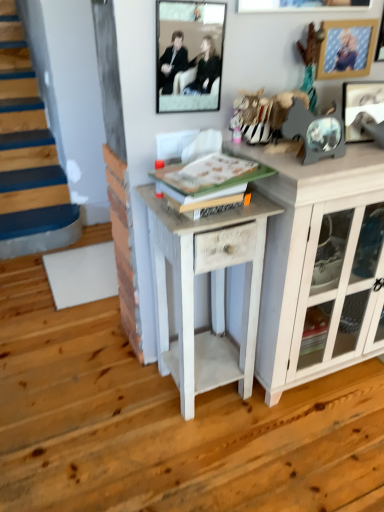
Describe the element at coordinates (193, 292) in the screenshot. Image resolution: width=384 pixels, height=512 pixels. I see `white painted wood side table at center` at that location.

Locate an element on the screen. Image resolution: width=384 pixels, height=512 pixels. matte black frame at upper center, which ranks as the 3th picture frame in right-to-left order is located at coordinates (189, 55).

In order to face wooden picture frame at upper right, acting as the second picture frame starting from the left, should I rotate leftwards or rightwards?

Turn right approximately 19.750 degrees to face it.

What do you see at coordinates (346, 48) in the screenshot? This screenshot has width=384, height=512. I see `wooden picture frame at upper right, the second picture frame when ordered from right to left` at bounding box center [346, 48].

What is the approximate height of white wood cabinet at right?

white wood cabinet at right is 35.92 inches tall.

Image resolution: width=384 pixels, height=512 pixels. What are the coordinates of `white painted wood side table at center` in the screenshot? It's located at (193, 292).

Is the depth of metallic silver picture frame at upper right, positioned as the 1th picture frame in right-to-left order, less than that of wooden picture frame at upper right, acting as the second picture frame starting from the left?

That is True.

From a real-world perspective, who is located higher, metallic silver picture frame at upper right, positioned as the 1th picture frame in right-to-left order, or wooden picture frame at upper right, acting as the second picture frame starting from the left?

wooden picture frame at upper right, acting as the second picture frame starting from the left.

Based on their sizes in the image, would you say metallic silver picture frame at upper right, positioned as the 1th picture frame in right-to-left order, is bigger or smaller than wooden picture frame at upper right, the second picture frame when ordered from right to left?

Considering their sizes, metallic silver picture frame at upper right, positioned as the 1th picture frame in right-to-left order, takes up more space than wooden picture frame at upper right, the second picture frame when ordered from right to left.

Is metallic silver picture frame at upper right, positioned as the 1th picture frame in right-to-left order, oriented towards wooden picture frame at upper right, the second picture frame when ordered from right to left?

No.

From the image's perspective, which is below, wooden picture frame at upper right, acting as the second picture frame starting from the left, or matte black frame at upper center, positioned as the 1th picture frame in left-to-right order?

matte black frame at upper center, positioned as the 1th picture frame in left-to-right order.

Can you confirm if wooden picture frame at upper right, acting as the second picture frame starting from the left, is thinner than matte black frame at upper center, which ranks as the 3th picture frame in right-to-left order?

In fact, wooden picture frame at upper right, acting as the second picture frame starting from the left, might be wider than matte black frame at upper center, which ranks as the 3th picture frame in right-to-left order.

Is wooden picture frame at upper right, the second picture frame when ordered from right to left, turned away from matte black frame at upper center, positioned as the 1th picture frame in left-to-right order?

wooden picture frame at upper right, the second picture frame when ordered from right to left, does not have its back to matte black frame at upper center, positioned as the 1th picture frame in left-to-right order.

From a real-world perspective, is wooden picture frame at upper right, the second picture frame when ordered from right to left, beneath matte black frame at upper center, positioned as the 1th picture frame in left-to-right order?

No, from a real-world perspective, wooden picture frame at upper right, the second picture frame when ordered from right to left, is not beneath matte black frame at upper center, positioned as the 1th picture frame in left-to-right order.

From the image's perspective, does metallic silver picture frame at upper right, positioned as the 1th picture frame in right-to-left order, appear lower than white wood cabinet at right?

No, from the image's perspective, metallic silver picture frame at upper right, positioned as the 1th picture frame in right-to-left order, is not below white wood cabinet at right.

Which of these two, metallic silver picture frame at upper right, the 3th picture frame when ordered from left to right, or white wood cabinet at right, stands shorter?

With less height is metallic silver picture frame at upper right, the 3th picture frame when ordered from left to right.

Are metallic silver picture frame at upper right, the 3th picture frame when ordered from left to right, and white wood cabinet at right beside each other?

They are not placed beside each other.

Considering the points (349, 97) and (357, 236), which point is behind, point (349, 97) or point (357, 236)?

Point (357, 236)

Is point (336, 61) positioned in front of point (268, 231)?

No, it is not.

From the image's perspective, who appears lower, wooden picture frame at upper right, the second picture frame when ordered from right to left, or white wood cabinet at right?

From the image's view, white wood cabinet at right is below.

There is a white wood cabinet at right. Find the location of `the 3rd picture frame above it (from a real-world perspective)`. the 3rd picture frame above it (from a real-world perspective) is located at coordinates (346, 48).

Considering the relative sizes of wooden picture frame at upper right, acting as the second picture frame starting from the left, and white wood cabinet at right in the image provided, is wooden picture frame at upper right, acting as the second picture frame starting from the left, thinner than white wood cabinet at right?

Indeed, wooden picture frame at upper right, acting as the second picture frame starting from the left, has a lesser width compared to white wood cabinet at right.

I want to click on picture frame that appears below the matte black frame at upper center, positioned as the 1th picture frame in left-to-right order (from a real-world perspective), so click(361, 106).

Considering the sizes of objects matte black frame at upper center, which ranks as the 3th picture frame in right-to-left order, and metallic silver picture frame at upper right, the 3th picture frame when ordered from left to right, in the image provided, who is thinner, matte black frame at upper center, which ranks as the 3th picture frame in right-to-left order, or metallic silver picture frame at upper right, the 3th picture frame when ordered from left to right,?

With smaller width is matte black frame at upper center, which ranks as the 3th picture frame in right-to-left order.

From a real-world perspective, which object rests below the other?

From a 3D spatial view, metallic silver picture frame at upper right, positioned as the 1th picture frame in right-to-left order, is below.

Is matte black frame at upper center, which ranks as the 3th picture frame in right-to-left order, further to the viewer compared to metallic silver picture frame at upper right, the 3th picture frame when ordered from left to right?

No.

From the picture: Which is behind, white painted wood side table at center or white wood cabinet at right?

white wood cabinet at right is behind.

From a real-world perspective, is white painted wood side table at center below white wood cabinet at right?

Yes, from a real-world perspective, white painted wood side table at center is beneath white wood cabinet at right.

From the image's perspective, who appears lower, white painted wood side table at center or white wood cabinet at right?

white painted wood side table at center, from the image's perspective.

Does white painted wood side table at center have a smaller size compared to white wood cabinet at right?

Yes, white painted wood side table at center is smaller than white wood cabinet at right.

Can you confirm if white wood cabinet at right is positioned to the right of matte black frame at upper center, positioned as the 1th picture frame in left-to-right order?

Yes, white wood cabinet at right is to the right of matte black frame at upper center, positioned as the 1th picture frame in left-to-right order.

Consider the image. Can you tell me how much white wood cabinet at right and matte black frame at upper center, which ranks as the 3th picture frame in right-to-left order, differ in facing direction?

0.308 degrees.

Locate an element on the screen. The image size is (384, 512). cabinetry below the matte black frame at upper center, which ranks as the 3th picture frame in right-to-left order (from the image's perspective) is located at coordinates (320, 266).

From a real-world perspective, which is physically above, white wood cabinet at right or matte black frame at upper center, which ranks as the 3th picture frame in right-to-left order?

matte black frame at upper center, which ranks as the 3th picture frame in right-to-left order, from a real-world perspective.

Identify the location of the 2nd picture frame located above the metallic silver picture frame at upper right, positioned as the 1th picture frame in right-to-left order (from a real-world perspective). (346, 48).

From a real-world perspective, starting from the wooden picture frame at upper right, the second picture frame when ordered from right to left, which picture frame is the 1st one below it? Please provide its 2D coordinates.

[(189, 55)]

Estimate the real-world distances between objects in this image. Which object is closer to white wood cabinet at right, matte black frame at upper center, positioned as the 1th picture frame in left-to-right order, or white painted wood side table at center?

Based on the image, white painted wood side table at center appears to be nearer to white wood cabinet at right.

Estimate the real-world distances between objects in this image. Which object is further from matte black frame at upper center, positioned as the 1th picture frame in left-to-right order, white painted wood side table at center or metallic silver picture frame at upper right, positioned as the 1th picture frame in right-to-left order?

white painted wood side table at center lies further to matte black frame at upper center, positioned as the 1th picture frame in left-to-right order, than the other object.

Based on their spatial positions, is wooden picture frame at upper right, acting as the second picture frame starting from the left, or white wood cabinet at right closer to matte black frame at upper center, positioned as the 1th picture frame in left-to-right order?

wooden picture frame at upper right, acting as the second picture frame starting from the left, is closer to matte black frame at upper center, positioned as the 1th picture frame in left-to-right order.

Considering their positions, is matte black frame at upper center, which ranks as the 3th picture frame in right-to-left order, positioned further to white painted wood side table at center than wooden picture frame at upper right, the second picture frame when ordered from right to left?

The object further to white painted wood side table at center is wooden picture frame at upper right, the second picture frame when ordered from right to left.

Looking at the image, which one is located closer to white wood cabinet at right, white painted wood side table at center or matte black frame at upper center, which ranks as the 3th picture frame in right-to-left order?

white painted wood side table at center is closer to white wood cabinet at right.

From the image, which object appears to be nearer to white painted wood side table at center, wooden picture frame at upper right, acting as the second picture frame starting from the left, or matte black frame at upper center, positioned as the 1th picture frame in left-to-right order?

matte black frame at upper center, positioned as the 1th picture frame in left-to-right order, is closer to white painted wood side table at center.

From the image, which object appears to be nearer to metallic silver picture frame at upper right, the 3th picture frame when ordered from left to right, white wood cabinet at right or wooden picture frame at upper right, acting as the second picture frame starting from the left?

Based on the image, wooden picture frame at upper right, acting as the second picture frame starting from the left, appears to be nearer to metallic silver picture frame at upper right, the 3th picture frame when ordered from left to right.

In the scene shown: When comparing their distances from matte black frame at upper center, which ranks as the 3th picture frame in right-to-left order, does metallic silver picture frame at upper right, positioned as the 1th picture frame in right-to-left order, or white wood cabinet at right seem closer?

The object closer to matte black frame at upper center, which ranks as the 3th picture frame in right-to-left order, is metallic silver picture frame at upper right, positioned as the 1th picture frame in right-to-left order.

I want to click on cabinetry between matte black frame at upper center, which ranks as the 3th picture frame in right-to-left order, and metallic silver picture frame at upper right, positioned as the 1th picture frame in right-to-left order, in the horizontal direction, so click(320, 266).

You are a GUI agent. You are given a task and a screenshot of the screen. Output one action in this format:
    pyautogui.click(x=<x>, y=<y>)
    Task: Click on the picture frame situated between matte black frame at upper center, positioned as the 1th picture frame in left-to-right order, and metallic silver picture frame at upper right, positioned as the 1th picture frame in right-to-left order, from left to right
    The height and width of the screenshot is (512, 384).
    Given the screenshot: What is the action you would take?
    pyautogui.click(x=346, y=48)

The width and height of the screenshot is (384, 512). I want to click on picture frame between matte black frame at upper center, positioned as the 1th picture frame in left-to-right order, and white painted wood side table at center vertically, so click(361, 106).

Find the location of a particular element. The width and height of the screenshot is (384, 512). cabinetry between matte black frame at upper center, which ranks as the 3th picture frame in right-to-left order, and white painted wood side table at center from top to bottom is located at coordinates (320, 266).